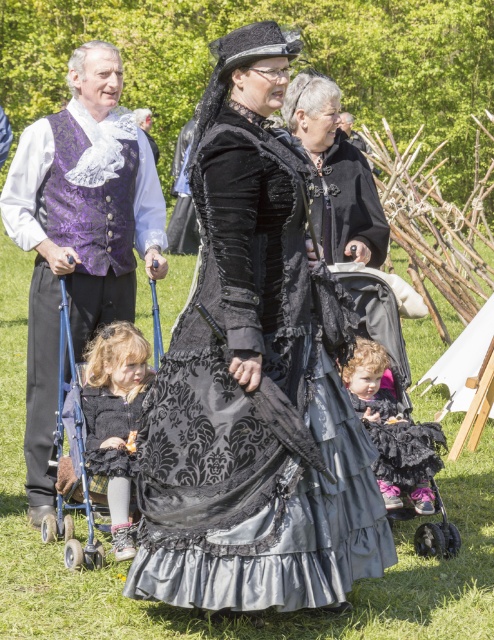
Question: Which of the following is the farthest from the observer?

Choices:
 (A) black lace baby carriage at center
 (B) black velvet dress at center
 (C) black lace dress at center

Answer: (C)

Question: Observing the image, what is the correct spatial positioning of black lace baby carriage at center in reference to velvet black dress at center?

Choices:
 (A) below
 (B) above

Answer: (A)

Question: Which point is farther from the camera taking this photo?

Choices:
 (A) (93, 410)
 (B) (345, 534)
 (C) (117, 484)

Answer: (A)

Question: Which point is closer to the camera?

Choices:
 (A) velvet black dress at center
 (B) metallic blue baby carriage at lower left
 (C) black velvet dress at center
 (D) purple brocade vest at left

Answer: (C)

Question: Does black lace baby carriage at center have a lesser width compared to metallic blue baby carriage at lower left?

Choices:
 (A) no
 (B) yes

Answer: (A)

Question: Is black lace baby carriage at center to the right of velvet black dress at center from the viewer's perspective?

Choices:
 (A) no
 (B) yes

Answer: (B)